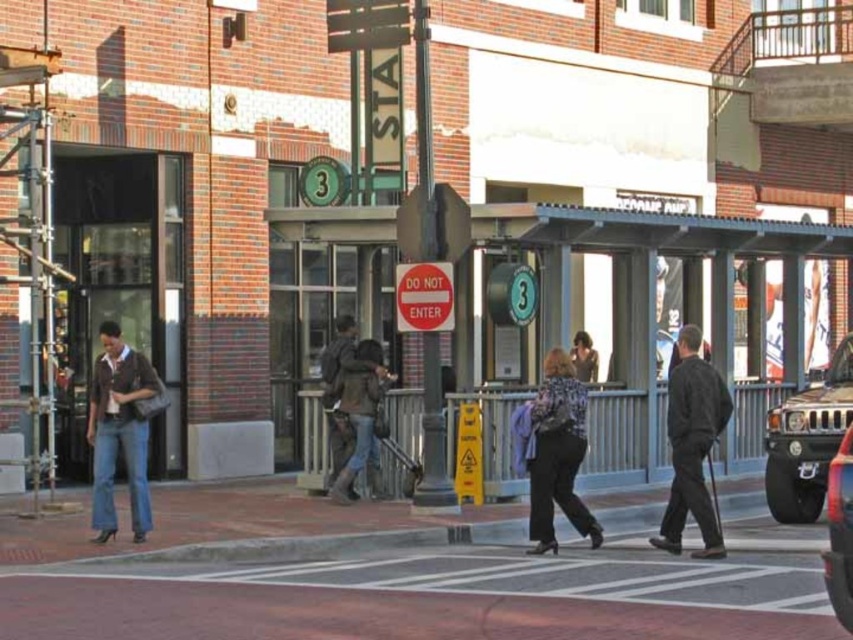
Question: Based on their relative distances, which object is farther from the dark gray jacket at center?

Choices:
 (A) smooth concrete pavement at center
 (B) denim jeans at left

Answer: (B)

Question: Which object is the farthest from the metallic silver suv at lower right?

Choices:
 (A) patterned fabric coat at center
 (B) denim jeans at left

Answer: (B)

Question: Does brown leather jacket at center come in front of metallic silver suv at lower right?

Choices:
 (A) no
 (B) yes

Answer: (A)

Question: Can you confirm if dark gray jacket at center is positioned to the right of metallic silver suv at lower right?

Choices:
 (A) yes
 (B) no

Answer: (B)

Question: Is brushed metal jeep at right smaller than dark brown leather jacket at center?

Choices:
 (A) no
 (B) yes

Answer: (A)

Question: Which of the following is the closest to the observer?

Choices:
 (A) patterned fabric coat at center
 (B) metallic silver suv at lower right
 (C) brushed metal jeep at right
 (D) dark gray jacket at center

Answer: (B)